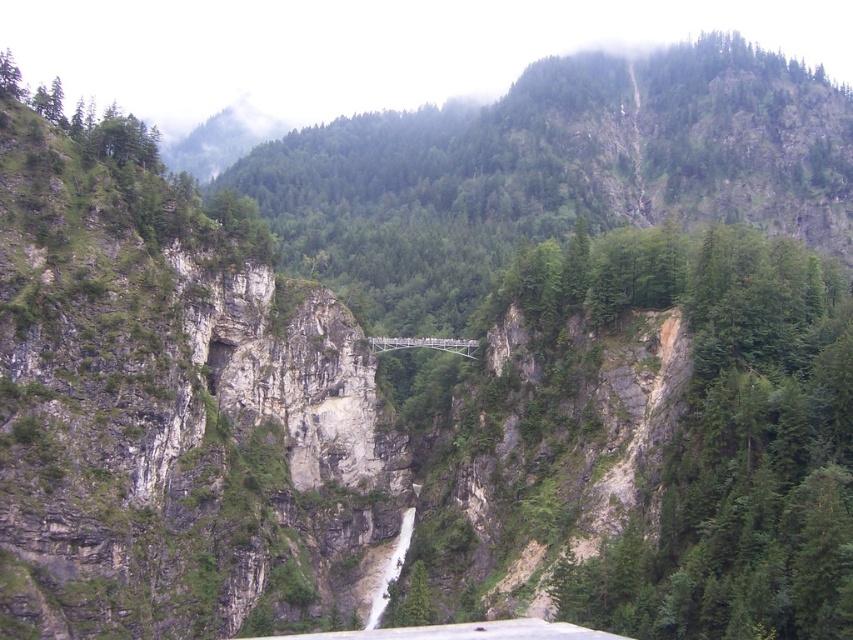
Question: Which point appears closest to the camera in this image?

Choices:
 (A) (213, 316)
 (B) (434, 346)
 (C) (378, 593)

Answer: (A)

Question: Is green matte tree at center-right wider than metallic gray bridge at center?

Choices:
 (A) yes
 (B) no

Answer: (A)

Question: Does green rock cliff at center have a smaller size compared to white stone waterfall at center?

Choices:
 (A) yes
 (B) no

Answer: (B)

Question: Which point is closer to the camera taking this photo?

Choices:
 (A) coord(218,346)
 (B) coord(376,611)
 (C) coord(729,353)
 (D) coord(459,340)

Answer: (C)

Question: Which object is positioned farthest from the green matte tree at center-right?

Choices:
 (A) green rock cliff at center
 (B) white stone waterfall at center

Answer: (B)

Question: Does green rock cliff at center have a larger size compared to white stone waterfall at center?

Choices:
 (A) no
 (B) yes

Answer: (B)